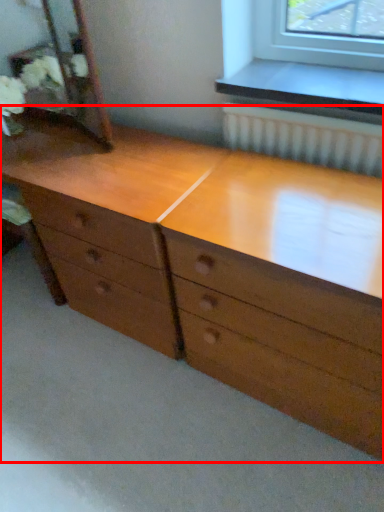
Question: From the image's perspective, what is the correct spatial positioning of chest of drawers (annotated by the red box) in reference to mirror?

Choices:
 (A) below
 (B) above

Answer: (A)